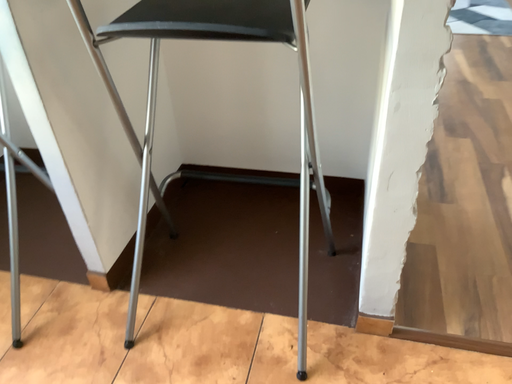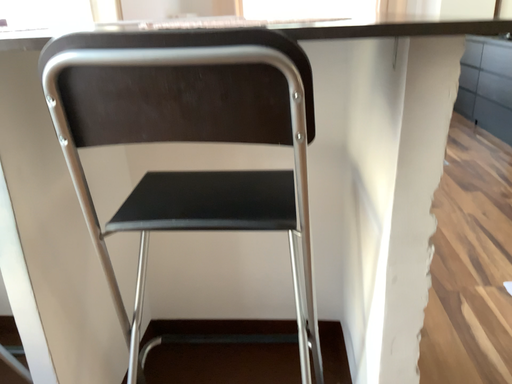
Question: Which way did the camera rotate in the video?

Choices:
 (A) rotated downward
 (B) rotated upward

Answer: (B)